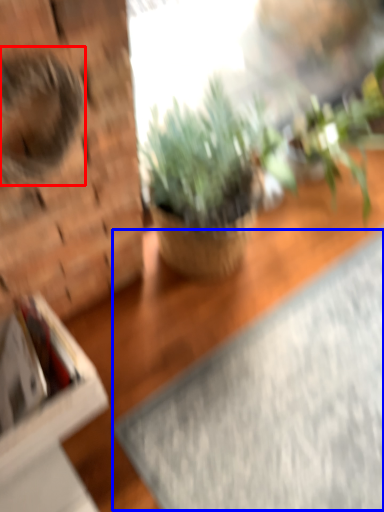
Question: Among these objects, which one is farthest to the camera, animal (highlighted by a red box) or yoga mat (highlighted by a blue box)?

Choices:
 (A) animal
 (B) yoga mat

Answer: (B)